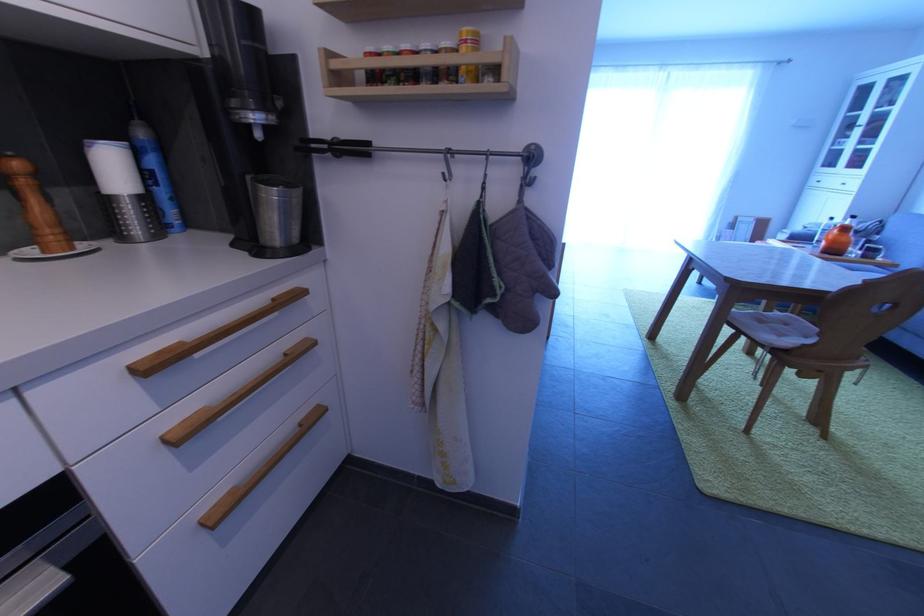
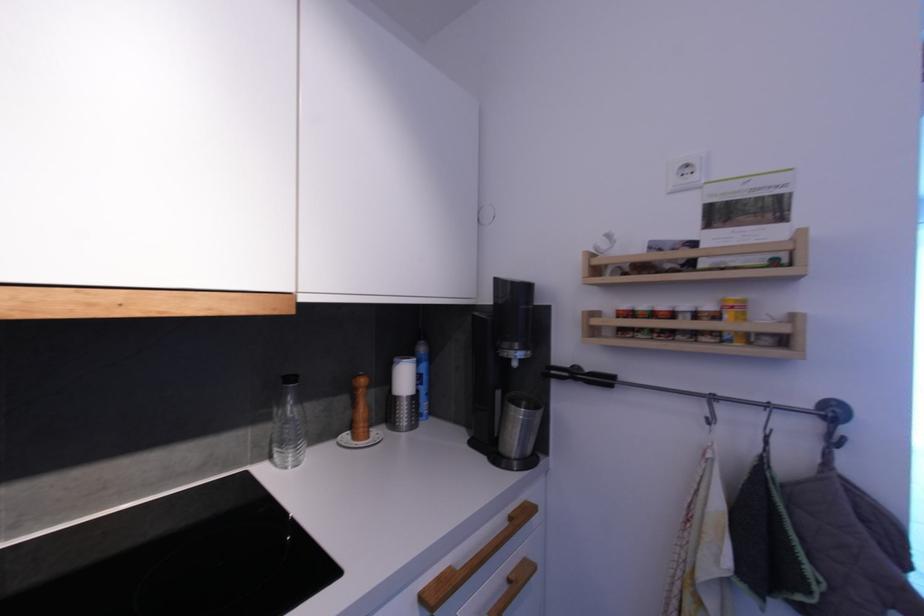
The point at (532, 183) is marked in the first image. Where is the corresponding point in the second image?

(837, 442)